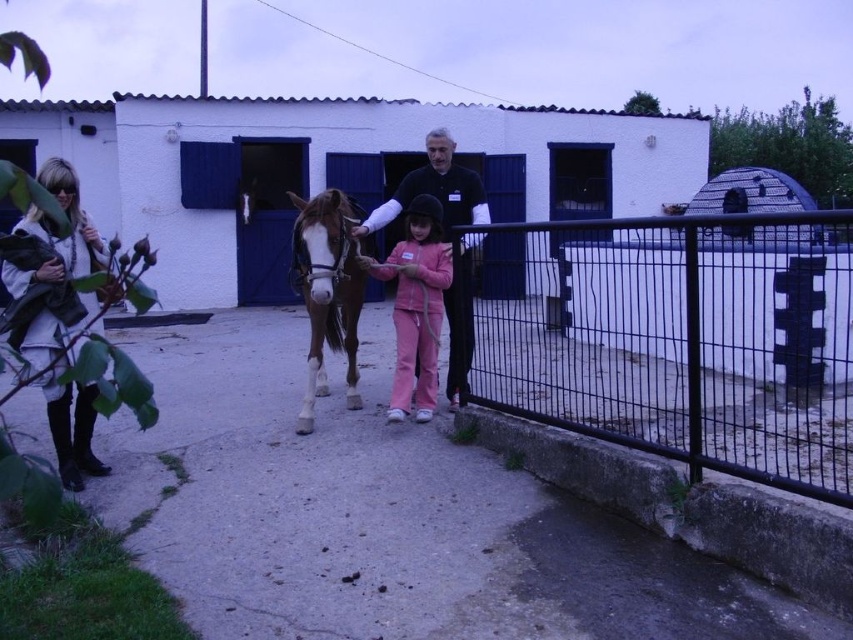
Question: Which point is farther to the camera?

Choices:
 (A) (61, 401)
 (B) (646, 378)
 (C) (354, 314)
 (D) (460, 204)

Answer: (B)

Question: Is white textured coat at left below black matte shirt at center?

Choices:
 (A) no
 (B) yes

Answer: (B)

Question: Among these points, which one is farthest from the camera?

Choices:
 (A) (47, 332)
 (B) (682, 404)
 (C) (448, 163)
 (D) (335, 284)

Answer: (B)

Question: Is black metal fence at right bigger than black matte shirt at center?

Choices:
 (A) yes
 (B) no

Answer: (A)

Question: Does white textured coat at left appear on the left side of brown glossy horse at center?

Choices:
 (A) yes
 (B) no

Answer: (A)

Question: Which is farther from the white textured coat at left?

Choices:
 (A) black matte shirt at center
 (B) brown glossy horse at center

Answer: (A)